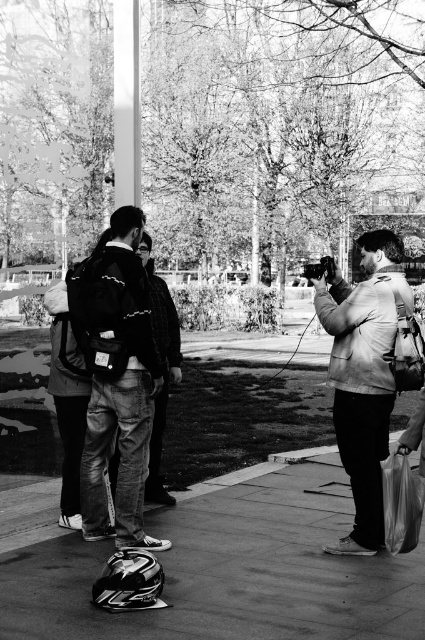
Does denim jacket at center come in front of dark gray jeans at center?

Yes, it is.

Is point (96, 348) positioned in front of point (175, 312)?

That is True.

Image resolution: width=425 pixels, height=640 pixels. What do you see at coordinates (118, 381) in the screenshot?
I see `denim jacket at center` at bounding box center [118, 381].

The image size is (425, 640). I want to click on denim jacket at center, so click(118, 381).

Is point (408, 356) positioned before point (159, 481)?

Yes, it is in front of point (159, 481).

Identify the location of matte beige jacket at right. This screenshot has width=425, height=640. (365, 372).

You are a GUI agent. You are given a task and a screenshot of the screen. Output one action in this format:
    pyautogui.click(x=<x>, y=<y>)
    Task: Click on the matte beige jacket at right
    
    Given the screenshot: What is the action you would take?
    pyautogui.click(x=365, y=372)

Identify the location of matte beige jacket at right. The width and height of the screenshot is (425, 640). (365, 372).

Which is more to the right, smooth concrete helmet at lower center or dark gray jeans at center?

smooth concrete helmet at lower center

Does smooth concrete helmet at lower center lie behind dark gray jeans at center?

No, it is in front of dark gray jeans at center.

Locate an element on the screen. smooth concrete helmet at lower center is located at coordinates (227, 566).

Where is `smooth concrete helmet at lower center`? This screenshot has height=640, width=425. smooth concrete helmet at lower center is located at coordinates (227, 566).